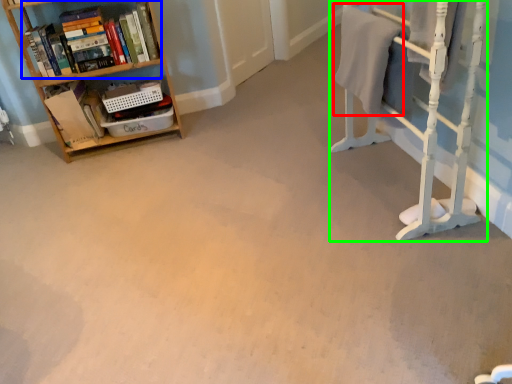
Question: Estimate the real-world distances between objects in this image. Which object is farther from bath towel (highlighted by a red box), book (highlighted by a blue box) or bunk bed (highlighted by a green box)?

Choices:
 (A) book
 (B) bunk bed

Answer: (A)